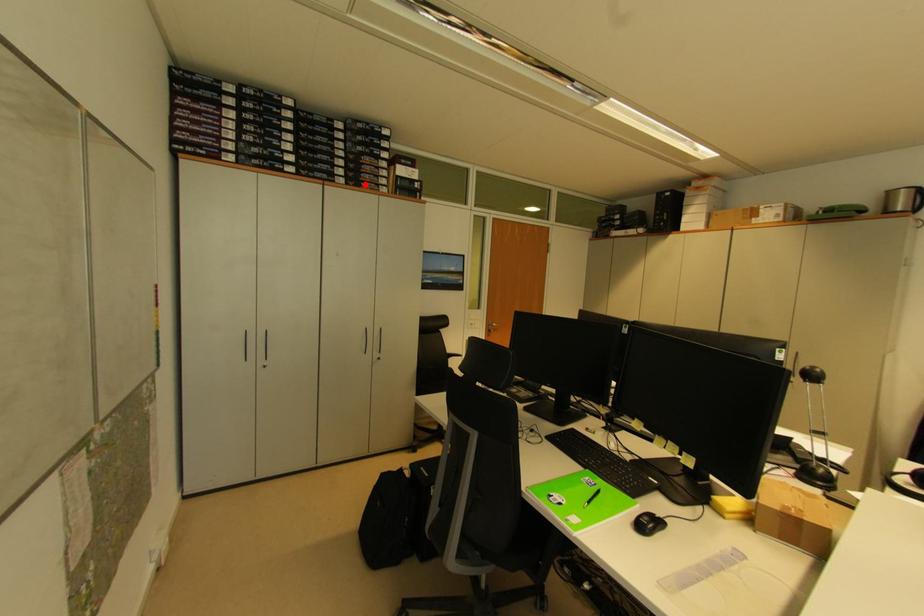
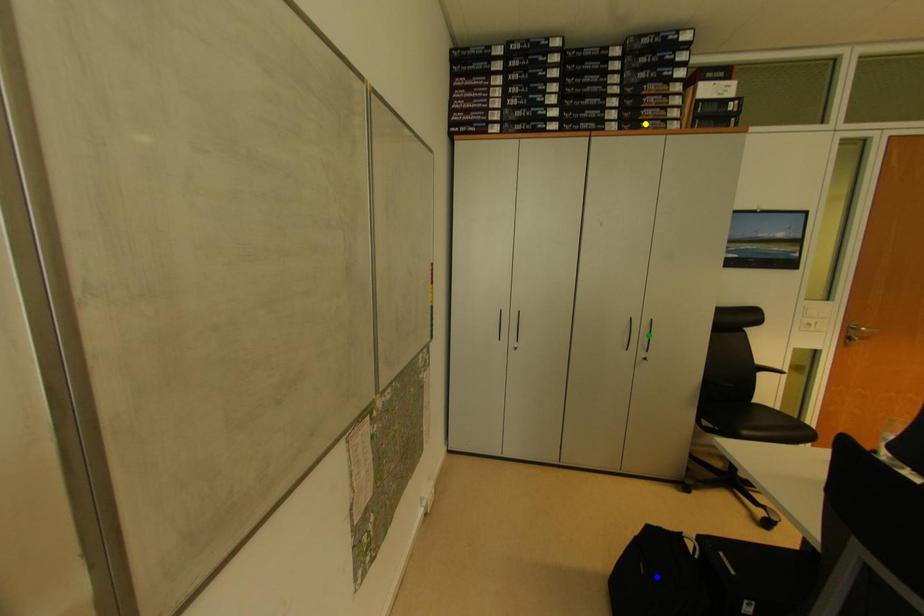
Question: I am providing you with two images of the same scene from different viewpoints. A red point is marked on the first image. You are given multiple points on the second image. Which spot in image 2 lines up with the point in image 1?

Choices:
 (A) green point
 (B) blue point
 (C) yellow point

Answer: (C)